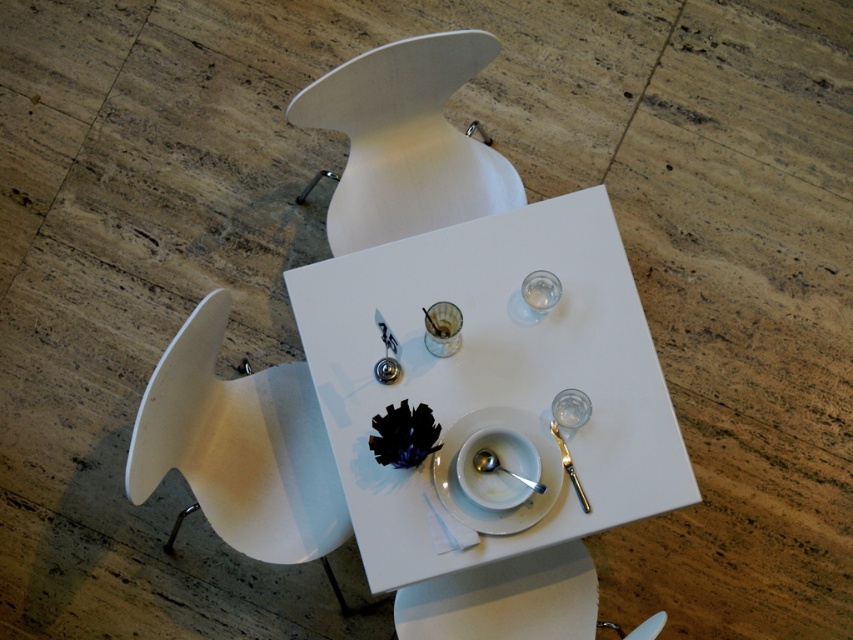
Can you confirm if black matte flower at center is shorter than transparent glass wine glass at center?

Yes.

Which is behind, point (410, 451) or point (582, 406)?

Positioned behind is point (582, 406).

The image size is (853, 640). What are the coordinates of `black matte flower at center` in the screenshot? It's located at pos(404,435).

Image resolution: width=853 pixels, height=640 pixels. What do you see at coordinates (492, 372) in the screenshot? I see `white glossy table at center` at bounding box center [492, 372].

Is white glossy table at center wider than white matte chair at upper center?

Yes, white glossy table at center is wider than white matte chair at upper center.

Does point (624, 499) come in front of point (422, 220)?

Yes.

The height and width of the screenshot is (640, 853). I want to click on white glossy table at center, so click(x=492, y=372).

Can you confirm if white matte chair at lower left is positioned to the right of transparent glass wine glass at center?

In fact, white matte chair at lower left is to the left of transparent glass wine glass at center.

Between white matte chair at lower left and transparent glass wine glass at center, which one is positioned higher?

transparent glass wine glass at center

Which is in front, point (212, 346) or point (560, 392)?

Point (560, 392) is in front.

Find the location of a particular element. white matte chair at lower left is located at coordinates click(x=241, y=449).